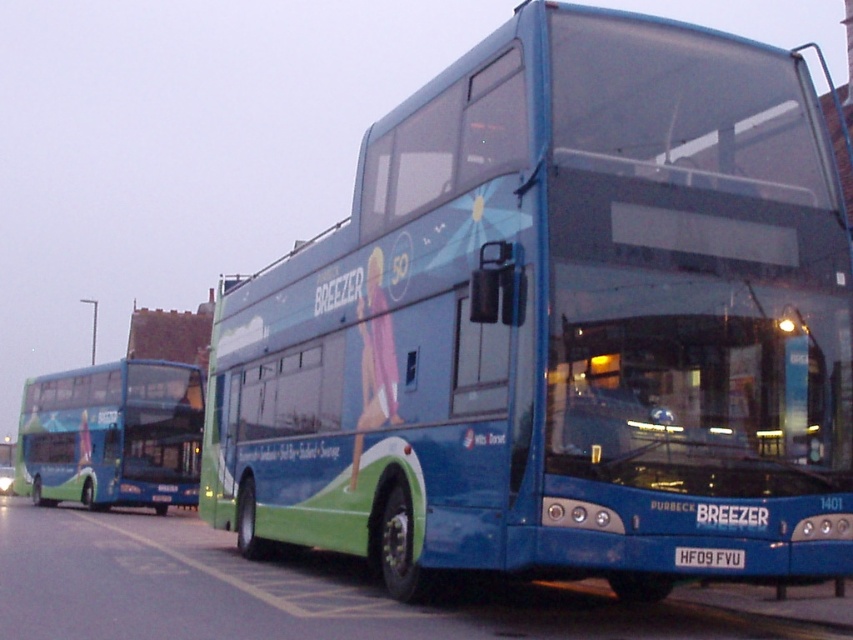
Who is taller, blue glossy bus at left or white plastic license plate at center?

Standing taller between the two is blue glossy bus at left.

Is the position of blue glossy bus at left less distant than that of white plastic license plate at center?

No, it is not.

Where is `blue glossy bus at left`? The image size is (853, 640). blue glossy bus at left is located at coordinates (112, 435).

Can you confirm if blue metallic bus at center is smaller than blue glossy bus at left?

Yes.

Is the position of blue metallic bus at center less distant than that of blue glossy bus at left?

That is True.

Is point (805, 476) less distant than point (161, 497)?

Yes.

The width and height of the screenshot is (853, 640). I want to click on blue metallic bus at center, so click(558, 324).

Locate an element on the screen. blue metallic bus at center is located at coordinates (558, 324).

Which is behind, point (422, 211) or point (709, 560)?

The point (422, 211) is behind.

The width and height of the screenshot is (853, 640). I want to click on blue metallic bus at center, so click(558, 324).